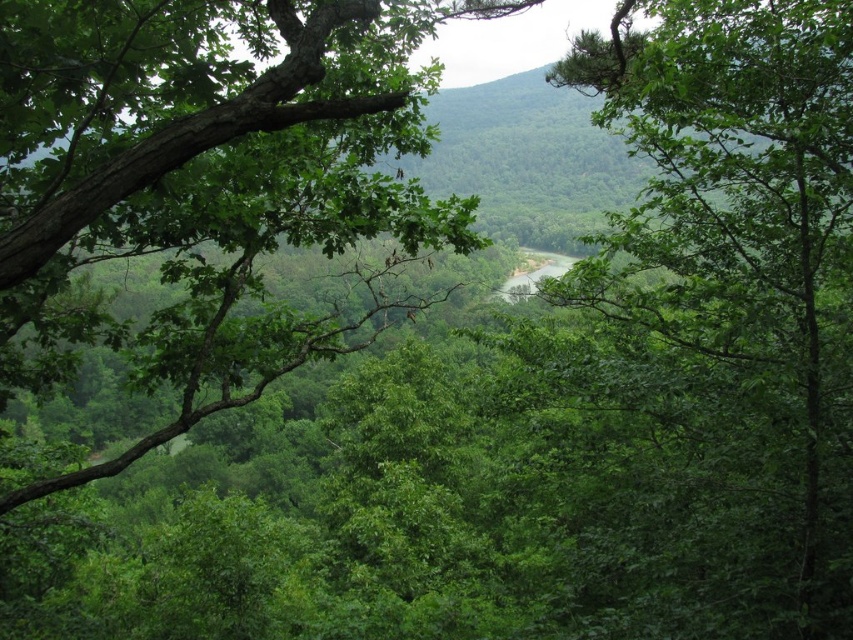
Is green leafy tree at center above green rough bark tree at left?

Correct, green leafy tree at center is located above green rough bark tree at left.

Is green leafy tree at center taller than green rough bark tree at left?

Indeed, green leafy tree at center has a greater height compared to green rough bark tree at left.

You are a GUI agent. You are given a task and a screenshot of the screen. Output one action in this format:
    pyautogui.click(x=<x>, y=<y>)
    Task: Click on the green leafy tree at center
    The width and height of the screenshot is (853, 640).
    Given the screenshot: What is the action you would take?
    pyautogui.click(x=727, y=308)